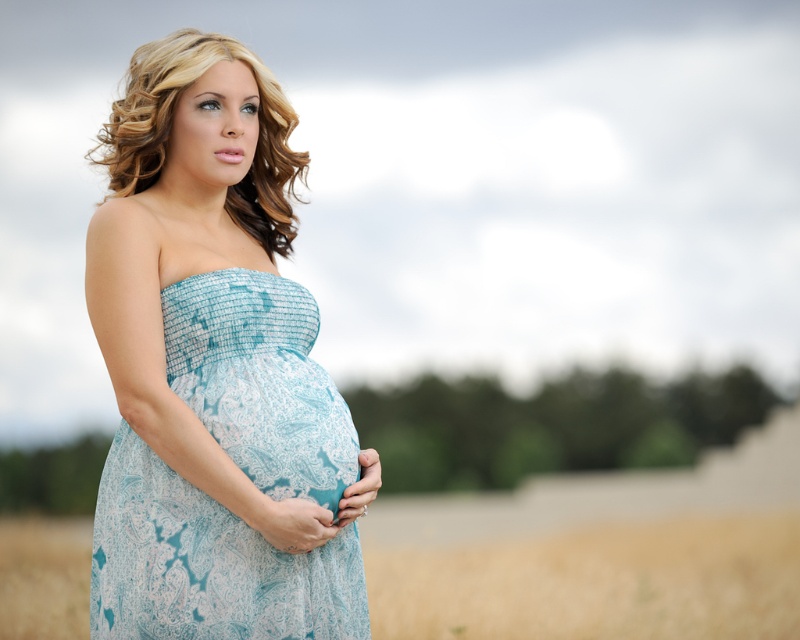
Based on the photo, you are a photographer planning to take a portrait of the pregnant woman in the scene. Considering the light blue lace dress at center and the golden wheat field at lower center, which object will appear larger in the photo?

The light blue lace dress at center will appear larger in the photo because it has a greater height compared to the golden wheat field at lower center.